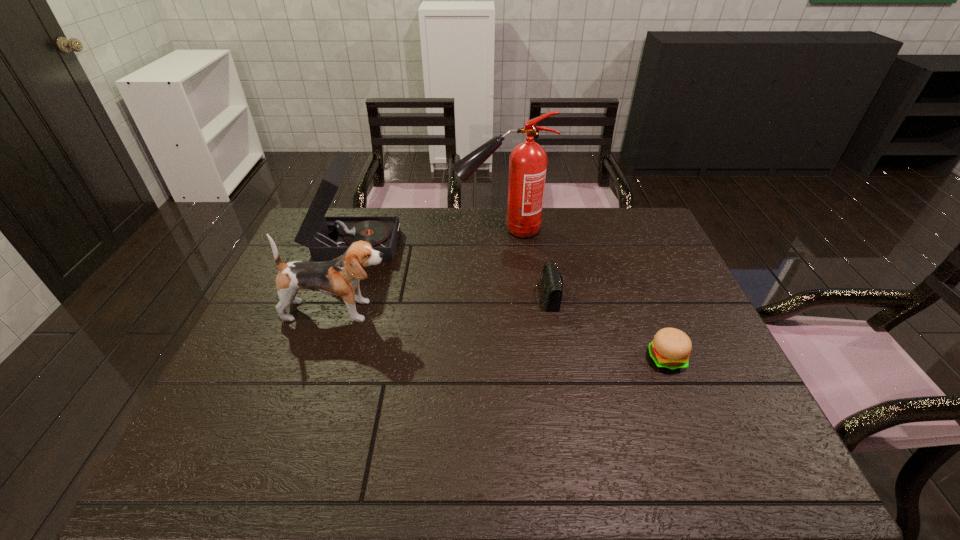
The height and width of the screenshot is (540, 960). In order to click on the tallest object in this screenshot , I will do [x=528, y=161].

Where is `phonograph_record`? phonograph_record is located at coordinates (327, 238).

At what (x,y) coordinates should I click in order to perform the action: click on puppy. Please return your answer as a coordinate pair (x, y). Image resolution: width=960 pixels, height=540 pixels. Looking at the image, I should click on (341, 276).

This screenshot has width=960, height=540. I want to click on clutch bag, so click(552, 283).

The image size is (960, 540). Find the location of `the nearest object`. the nearest object is located at coordinates (670, 349).

Identify the location of hamburger. (670, 349).

Locate an element on the screen. The width and height of the screenshot is (960, 540). vacant region located 0.250m at the nozzle end of the tallest object is located at coordinates (382, 230).

This screenshot has height=540, width=960. I want to click on free space located at the nozzle end of the tallest object, so click(428, 230).

You are a GUI agent. You are given a task and a screenshot of the screen. Output one action in this format:
    pyautogui.click(x=<x>, y=<y>)
    Task: Click on the vacant space situated 0.130m at the nozzle end of the tallest object
    
    Given the screenshot: What is the action you would take?
    pyautogui.click(x=417, y=230)

This screenshot has width=960, height=540. Identify the location of vacant space located 0.230m on the front-facing side of the phonograph_record. (468, 241).